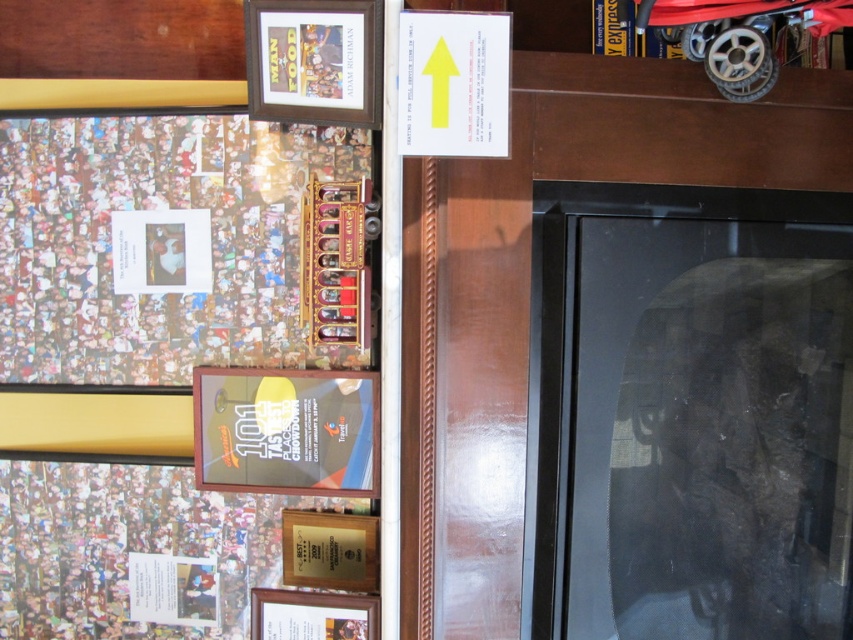
Question: Can you confirm if brown wooden picture frame at upper center is thinner than wooden picture frame at lower center?

Choices:
 (A) no
 (B) yes

Answer: (B)

Question: Which is farther from the wooden picture frame at lower center?

Choices:
 (A) wooden plaque at lower center
 (B) brown wooden picture frame at upper center
 (C) matte plastic picture frame at center
 (D) black glass fireplace at right

Answer: (B)

Question: Is black glass fireplace at right above wooden picture frame at lower center?

Choices:
 (A) no
 (B) yes

Answer: (B)

Question: Which point is farther from the camera taking this photo?

Choices:
 (A) (314, 458)
 (B) (645, 305)
 (C) (294, 42)
 (D) (376, 556)

Answer: (D)

Question: Can you confirm if matte plastic picture frame at center is bigger than wooden picture frame at lower center?

Choices:
 (A) yes
 (B) no

Answer: (A)

Question: Which point is closer to the camera?

Choices:
 (A) (329, 52)
 (B) (363, 576)

Answer: (A)